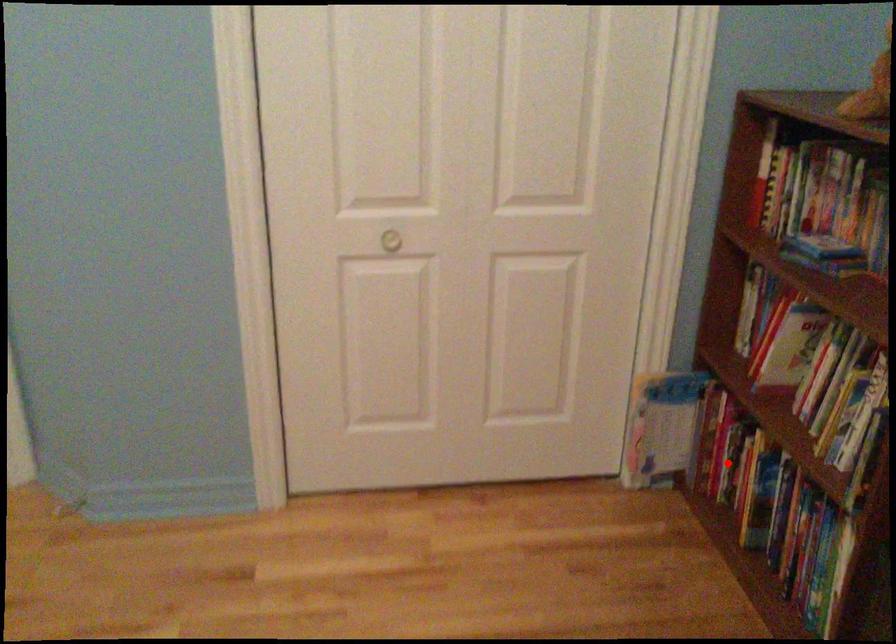
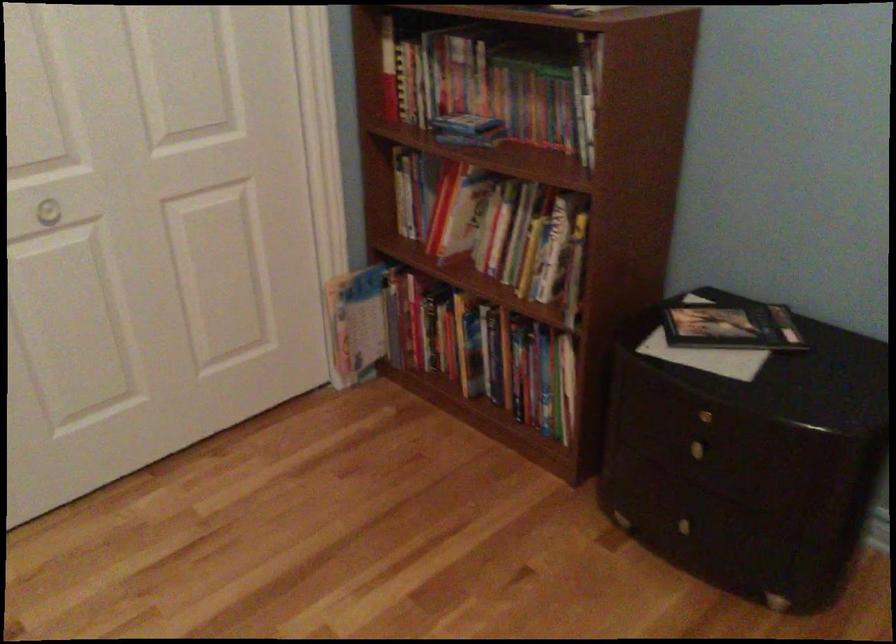
Question: I am providing you with two images of the same scene from different viewpoints. A red point is marked on the first image. Can you still see the location of the red point in image 2?

Choices:
 (A) Yes
 (B) No

Answer: (A)